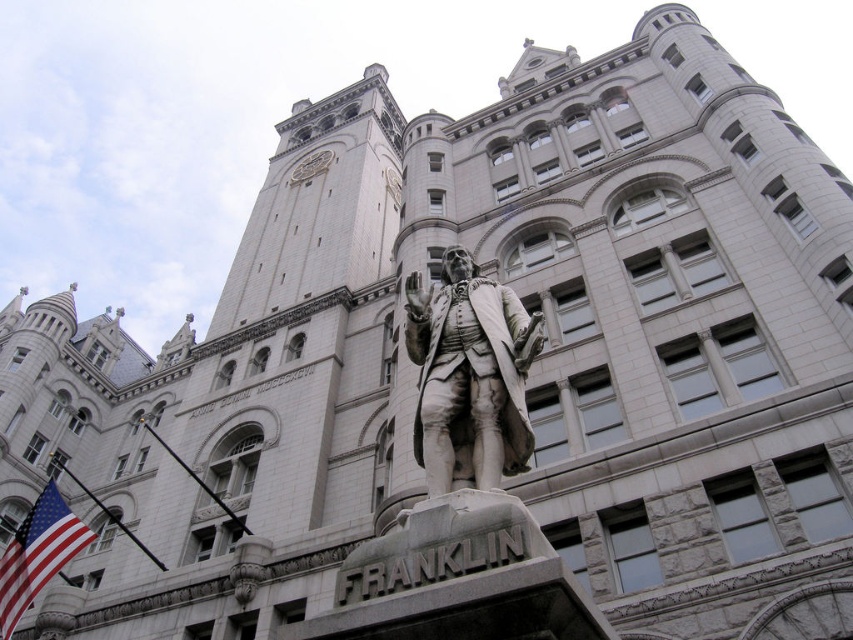
In the scene shown: You are standing in front of the historic building and want to place a new plaque on the wall. The plaque needs to be placed above the red fabric flag at lower left. Can you place it on the white marble statue at center?

The white marble statue at center is positioned over red fabric flag at lower left, so placing the plaque above the red fabric flag at lower left would require placing it on the white marble statue at center.

Consider the image. You are a tour guide leading a group to the white marble statue at center. You notice a red fabric flag at lower left that needs to be placed exactly 40 meters away from the statue. Based on the current distance, is the flag too close or too far?

The white marble statue at center and red fabric flag at lower left are currently 37.06 meters apart. Since 37.06 meters is less than 40 meters, the flag is too close and needs to be moved further away to meet the required distance.